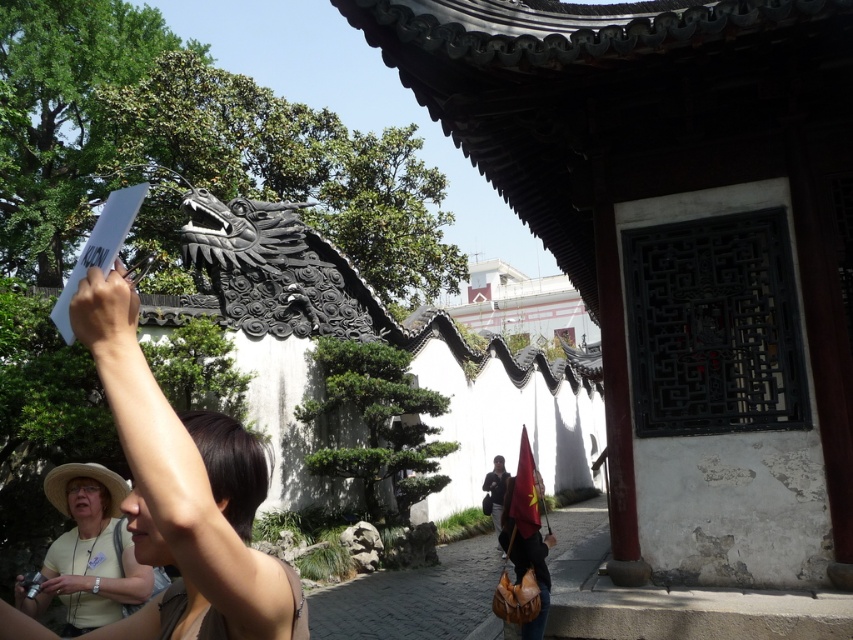
Between matte black hair at upper left and dark blue fabric bag at lower center, which one has less height?

Standing shorter between the two is matte black hair at upper left.

Where is `matte black hair at upper left`? matte black hair at upper left is located at coordinates (184, 481).

Which is more to the left, yellow fabric at center or dark blue fabric bag at lower center?

Positioned to the left is yellow fabric at center.

Does point (96, 516) lie behind point (494, 502)?

No, it is in front of (494, 502).

The height and width of the screenshot is (640, 853). What do you see at coordinates (88, 552) in the screenshot? I see `yellow fabric at center` at bounding box center [88, 552].

Locate an element on the screen. yellow fabric at center is located at coordinates (88, 552).

Is matte black hair at upper left further to camera compared to yellow fabric at center?

That is False.

Between matte black hair at upper left and yellow fabric at center, which one is positioned lower?

Positioned lower is yellow fabric at center.

Is point (183, 518) behind point (109, 582)?

No, it is in front of (109, 582).

Locate an element on the screen. The height and width of the screenshot is (640, 853). matte black hair at upper left is located at coordinates (184, 481).